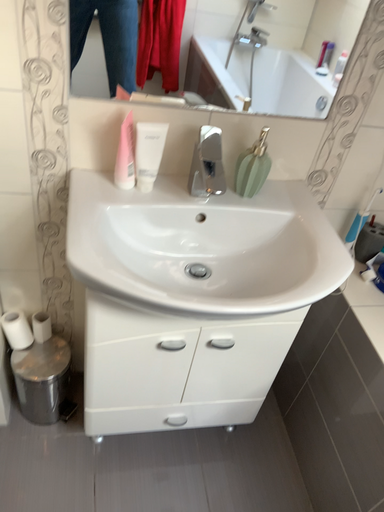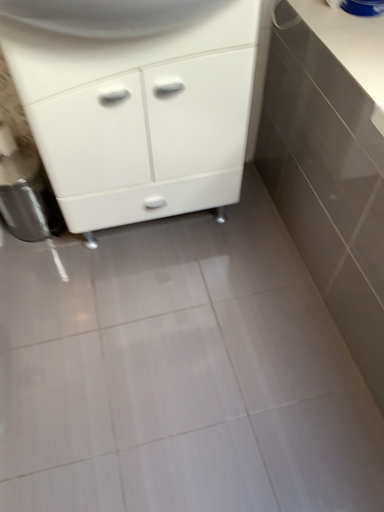
Question: Which way did the camera rotate in the video?

Choices:
 (A) rotated downward
 (B) rotated upward

Answer: (A)